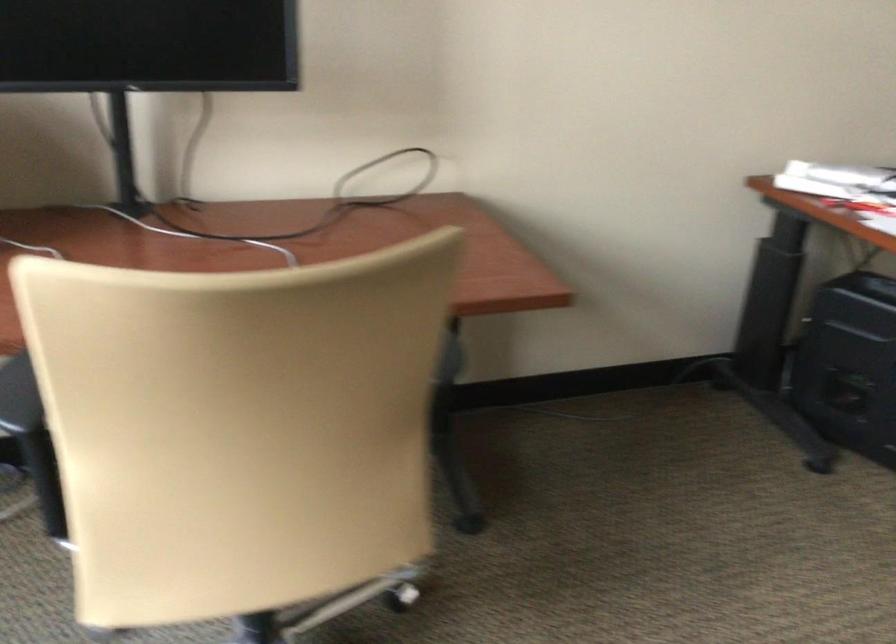
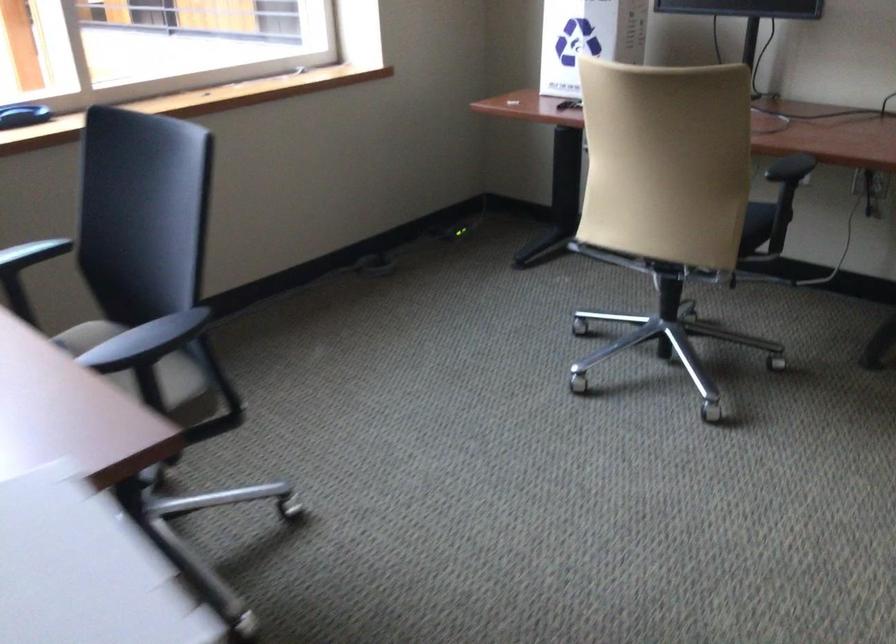
Locate, in the second image, the point that corresponds to (382,469) in the first image.

(755, 225)